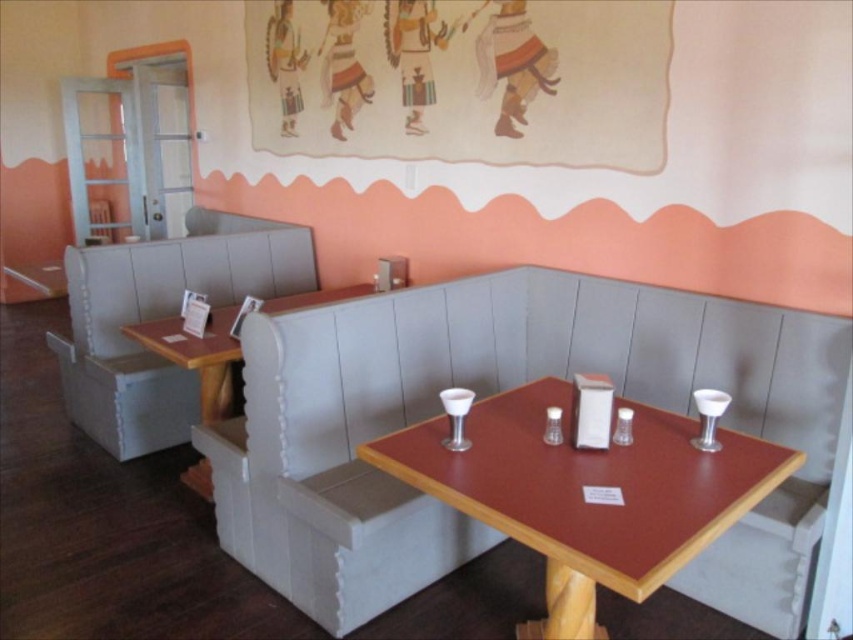
Can you confirm if white fabric chair at center is positioned to the right of wooden table at center?

In fact, white fabric chair at center is to the left of wooden table at center.

Identify the location of white fabric chair at center. (347, 449).

Locate an element on the screen. This screenshot has height=640, width=853. white fabric chair at center is located at coordinates (347, 449).

Between point (546, 518) and point (177, 422), which one is positioned in front?

Point (546, 518)

Locate an element on the screen. This screenshot has height=640, width=853. wooden table at center is located at coordinates (582, 496).

Locate an element on the screen. This screenshot has height=640, width=853. wooden table at center is located at coordinates (582, 496).

Looking at this image, can you confirm if white fabric chair at center is positioned to the right of white fabric booth at left?

Correct, you'll find white fabric chair at center to the right of white fabric booth at left.

Who is higher up, white fabric chair at center or white fabric booth at left?

white fabric booth at left is higher up.

Who is more distant from viewer, (321, 330) or (59, 342)?

The point (59, 342) is more distant.

The width and height of the screenshot is (853, 640). In order to click on white fabric chair at center in this screenshot , I will do `click(347, 449)`.